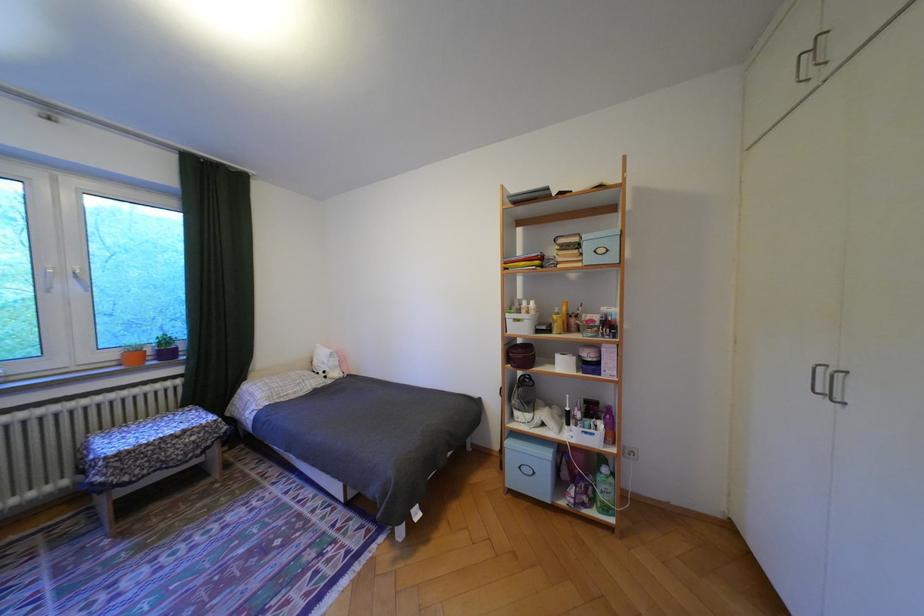
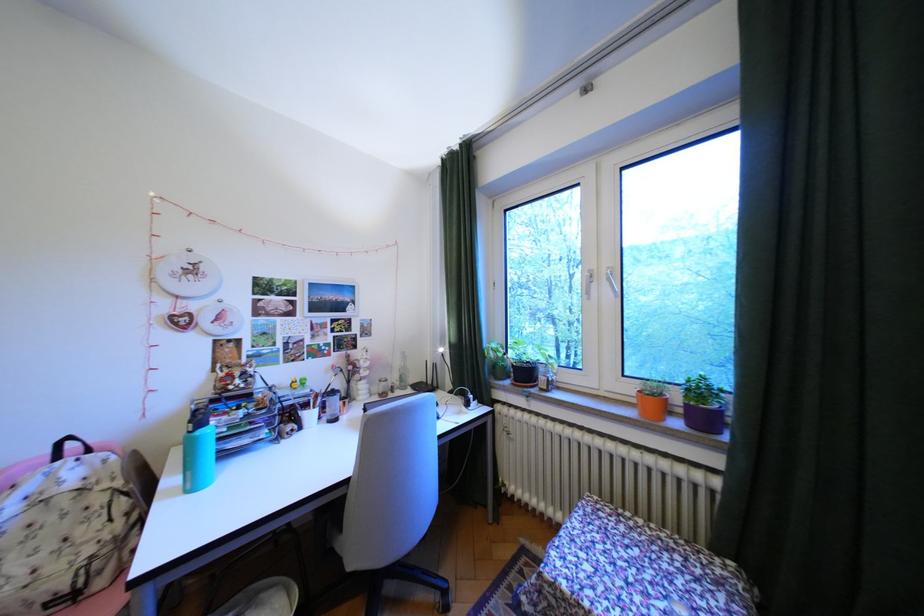
Question: I am providing you with two images of the same scene from different viewpoints. Which of the following objects are not visible in image2?

Choices:
 (A) white pen cup
 (B) floral sofa sitting surface
 (C) clear glass bottle
 (D) none of these

Answer: (D)